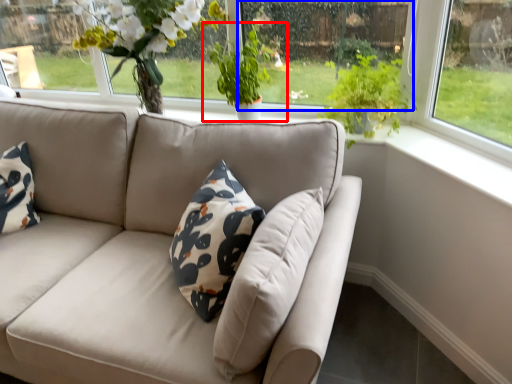
Question: Which object appears closest to the camera in this image, houseplant (highlighted by a red box) or window screen (highlighted by a blue box)?

Choices:
 (A) houseplant
 (B) window screen

Answer: (B)